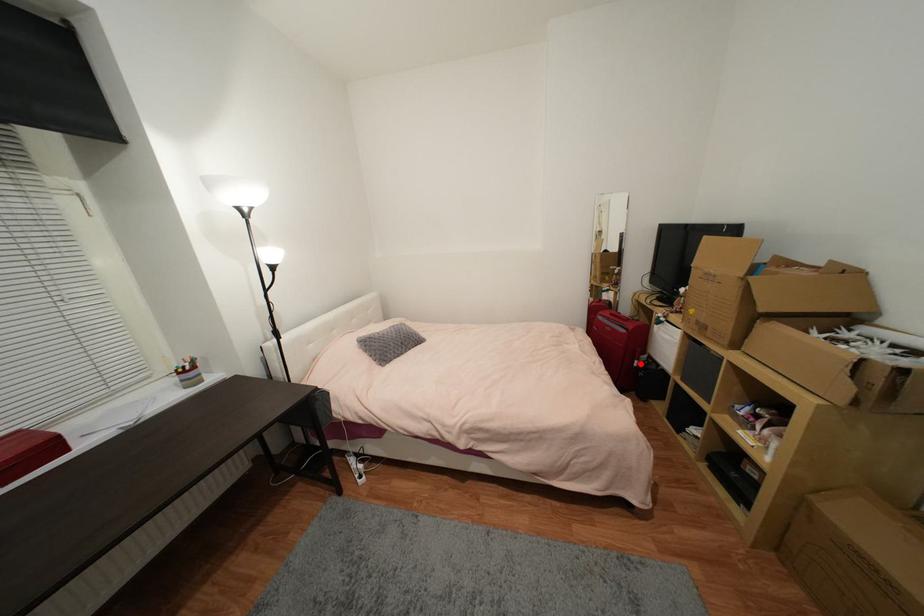
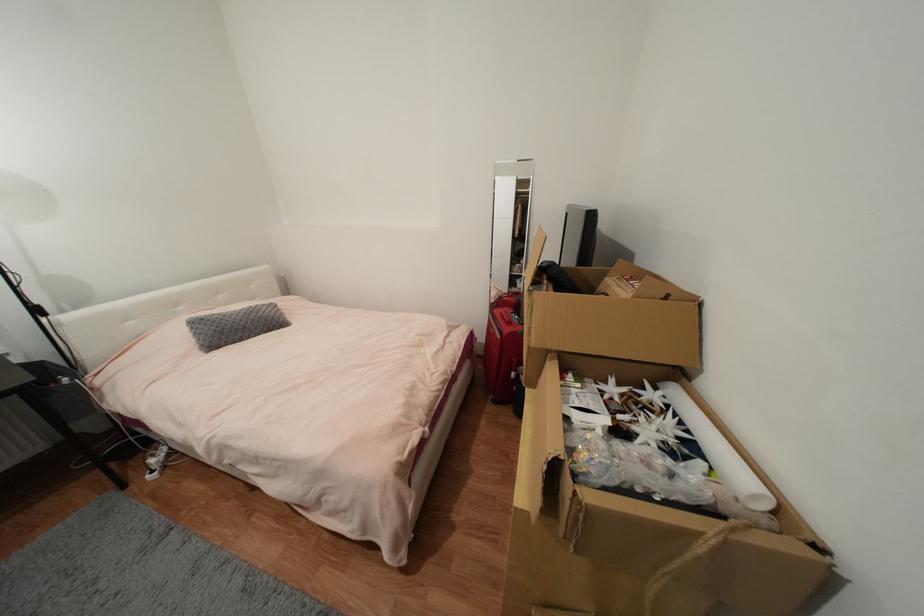
In the second image, find the point that corresponds to the highlighted location in the first image.

(517, 375)